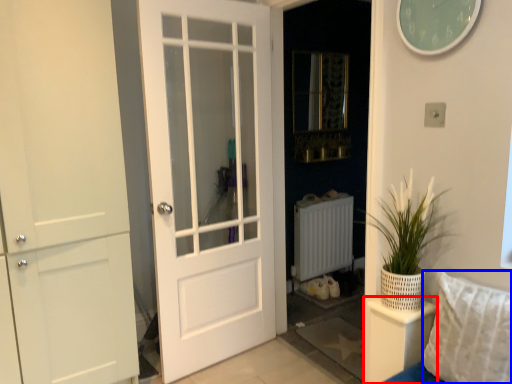
Question: Which point is further to the camera, furniture (highlighted by a red box) or pillow (highlighted by a blue box)?

Choices:
 (A) furniture
 (B) pillow

Answer: (A)